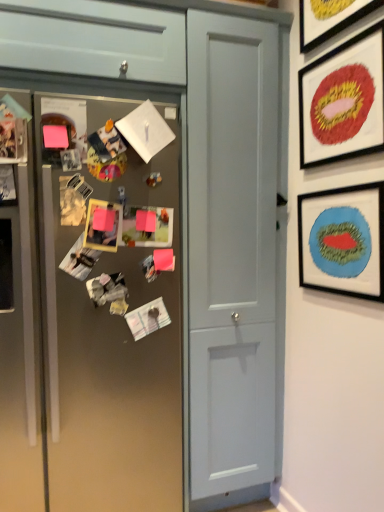
Question: Should I look upward or downward to see metallic silver photo frame at left, acting as the second art starting from the right?

Choices:
 (A) down
 (B) up

Answer: (A)

Question: Can you confirm if matte gray door at center is wider than blue matte picture frame at right, marked as the first picture frame in a bottom-to-top arrangement?

Choices:
 (A) yes
 (B) no

Answer: (A)

Question: Is matte gray door at center further to camera compared to blue matte picture frame at right, marked as the first picture frame in a bottom-to-top arrangement?

Choices:
 (A) yes
 (B) no

Answer: (A)

Question: From a real-world perspective, is matte gray door at center on blue matte picture frame at right, acting as the third picture frame starting from the top?

Choices:
 (A) no
 (B) yes

Answer: (A)

Question: Is matte gray door at center in front of blue matte picture frame at right, acting as the third picture frame starting from the top?

Choices:
 (A) no
 (B) yes

Answer: (A)

Question: Can you confirm if matte gray door at center is thinner than blue matte picture frame at right, marked as the first picture frame in a bottom-to-top arrangement?

Choices:
 (A) yes
 (B) no

Answer: (B)

Question: Does matte gray door at center appear on the left side of blue matte picture frame at right, marked as the first picture frame in a bottom-to-top arrangement?

Choices:
 (A) no
 (B) yes

Answer: (B)

Question: Is metallic silver photo frame at left, acting as the second art starting from the right, bigger than matte gray door at center?

Choices:
 (A) no
 (B) yes

Answer: (A)

Question: Can matte gray door at center be found inside metallic silver photo frame at left, arranged as the first art when viewed from the front?

Choices:
 (A) yes
 (B) no

Answer: (B)

Question: Is metallic silver photo frame at left, which is the 1th art from left to right, closer to camera compared to matte gray door at center?

Choices:
 (A) no
 (B) yes

Answer: (B)

Question: Would you say metallic silver photo frame at left, arranged as the first art when viewed from the front, is outside matte gray door at center?

Choices:
 (A) yes
 (B) no

Answer: (A)

Question: Is metallic silver photo frame at left, which is the 1th art from left to right, facing away from matte gray door at center?

Choices:
 (A) yes
 (B) no

Answer: (B)

Question: From a real-world perspective, is metallic silver photo frame at left, which is the 1th art from left to right, under matte gray door at center?

Choices:
 (A) yes
 (B) no

Answer: (A)

Question: Does metallic gray fridge at left appear on the right side of metallic silver photo frame at left, the 2th art from the back?

Choices:
 (A) no
 (B) yes

Answer: (A)